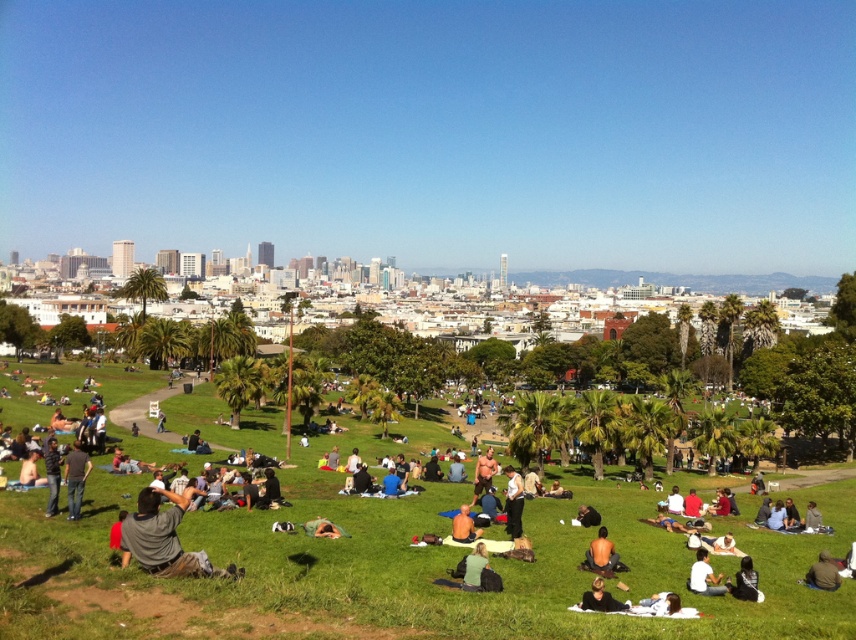
Question: Which object is closer to the camera taking this photo?

Choices:
 (A) dark brown leather jacket at center
 (B) dark gray fabric shirt at lower left
 (C) muscular tan torso at center
 (D) tan skin person at center

Answer: (B)

Question: Considering the real-world distances, which object is farthest from the dark brown leather jacket at center?

Choices:
 (A) dark brown leather jacket at lower center
 (B) dark green fabric at lower right

Answer: (B)

Question: Considering the real-world distances, which object is closest to the dark gray pants at center?

Choices:
 (A) dark brown leather jacket at center
 (B) dark gray hoodie at lower right

Answer: (A)

Question: Does dark brown leather jacket at lower center lie behind muscular tan torso at center?

Choices:
 (A) no
 (B) yes

Answer: (A)

Question: In this image, where is dark gray fabric shirt at lower left located relative to dark gray hoodie at lower right?

Choices:
 (A) below
 (B) above

Answer: (B)

Question: Is muscular tan torso at center above dark brown leather jacket at center?

Choices:
 (A) no
 (B) yes

Answer: (B)